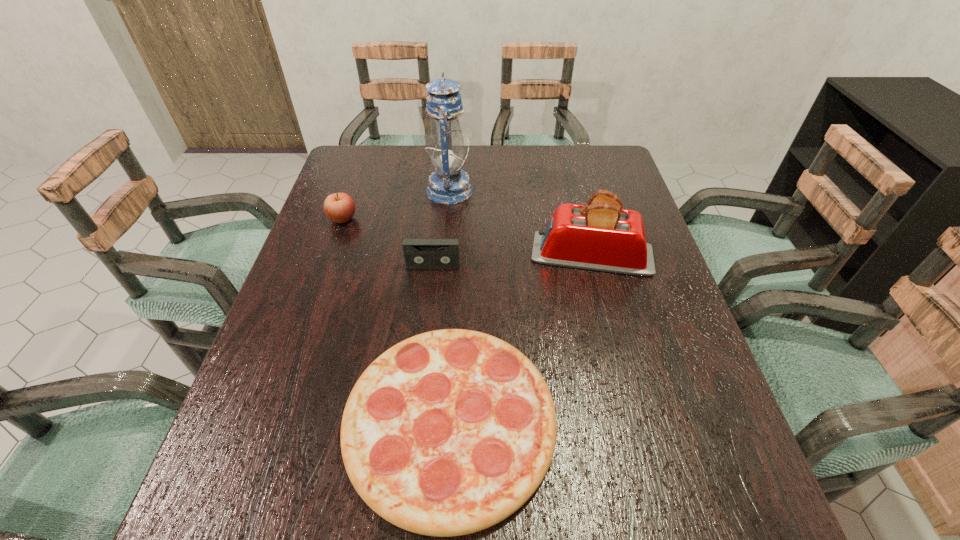
At what (x,y) coordinates should I click in order to perform the action: click on the tallest object. Please return your answer as a coordinate pair (x, y). Looking at the image, I should click on (448, 185).

Locate an element on the screen. the farthest object is located at coordinates (448, 185).

Image resolution: width=960 pixels, height=540 pixels. Find the location of `the second tallest object`. the second tallest object is located at coordinates (601, 236).

Image resolution: width=960 pixels, height=540 pixels. Find the location of `the second farthest object`. the second farthest object is located at coordinates (339, 207).

I want to click on apple, so click(x=339, y=207).

Find the location of a particular element. Image resolution: width=960 pixels, height=540 pixels. videotape is located at coordinates (419, 253).

Find the location of a particular element. pizza is located at coordinates (449, 432).

Where is `the nearest object`? This screenshot has width=960, height=540. the nearest object is located at coordinates [x=449, y=432].

You are a GUI agent. You are given a task and a screenshot of the screen. Output one action in this format:
    pyautogui.click(x=<x>, y=<y>)
    Task: Click on the vacant space located on the front-facing side of the farthest object
    The height and width of the screenshot is (540, 960).
    Given the screenshot: What is the action you would take?
    pyautogui.click(x=598, y=191)

Where is `vacant region located 0.050m on the front of the toaster`? The image size is (960, 540). vacant region located 0.050m on the front of the toaster is located at coordinates (602, 293).